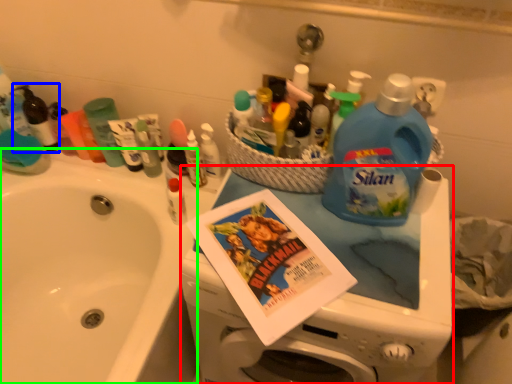
Question: Based on their relative distances, which object is nearer to appliance (highlighted by a red box)? Choose from toiletry (highlighted by a blue box) and sink (highlighted by a green box).

Choices:
 (A) toiletry
 (B) sink

Answer: (B)